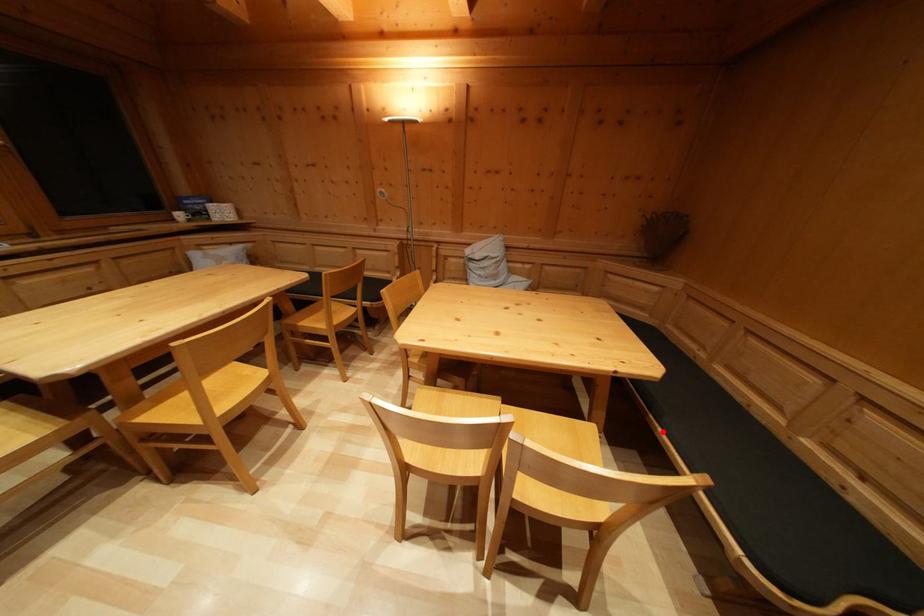
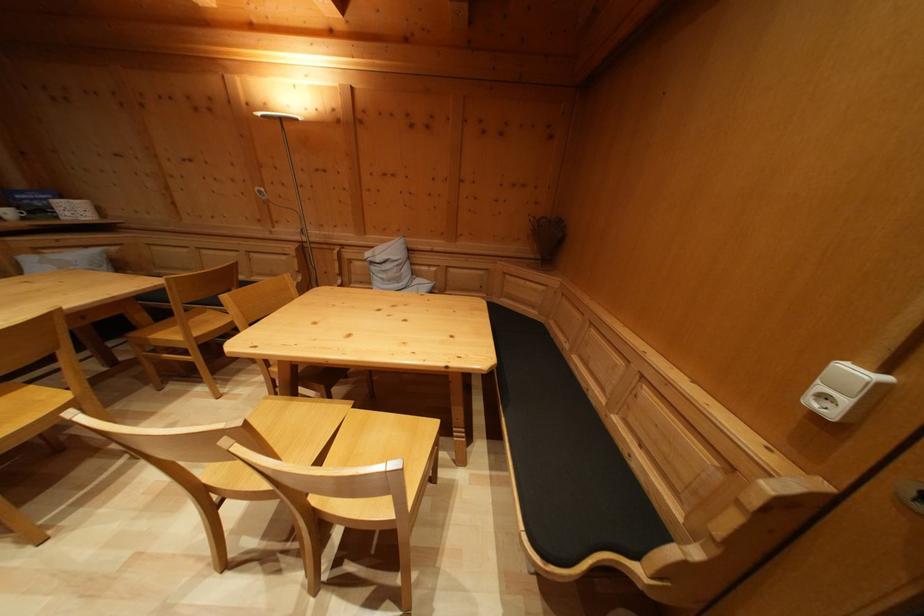
In the second image, find the point that corresponds to the highlighted location in the first image.

(507, 422)